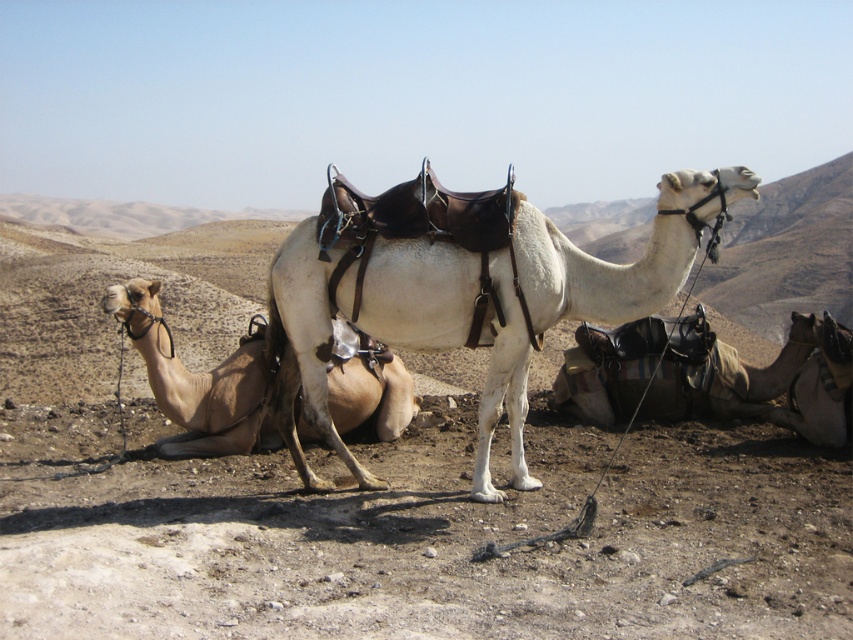
You are a traveler in the desert and need to locate the white leather saddle at center. According to the coordinates given, where exactly is it positioned?

The white leather saddle at center is positioned at coordinates point (532, 294).

You are a traveler in the desert and need to load your gear onto the camel. Which camel should you choose to place your gear on, the light brown leather camel at center or the brown leather saddle at lower right? Explain your reasoning based on their positions.

You should place your gear on the light brown leather camel at center because the brown leather saddle at lower right is positioned above it, indicating that the saddle is already on the camel.

You are a traveler preparing to ride a camel in the desert. You have a 100 cm long rope to secure your belongings. Can you safely tie your rope between the white leather saddle at center and the light brown leather camel at center without it dragging on the ground?

The distance between the white leather saddle at center and the light brown leather camel at center is 96.93 centimeters. Since your rope is 100 cm long, it should be sufficient to securely tie between them without dragging on the ground.